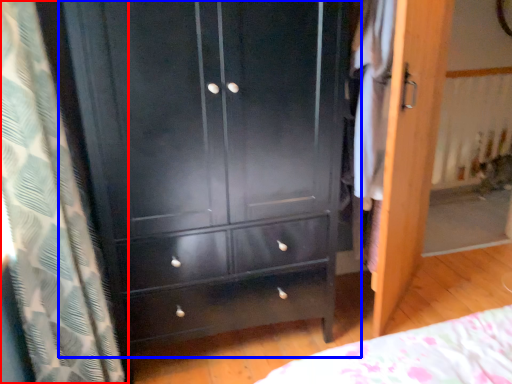
Question: Among these objects, which one is farthest to the camera, curtain (highlighted by a red box) or chest of drawers (highlighted by a blue box)?

Choices:
 (A) curtain
 (B) chest of drawers

Answer: (B)